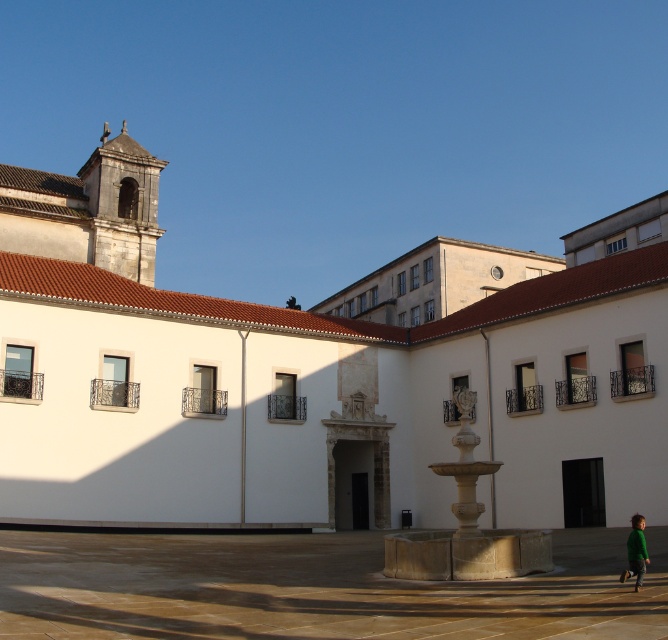
Question: Which is farther from the smooth stone fountain at center?

Choices:
 (A) white stone church at center
 (B) green matte shirt at lower right

Answer: (A)

Question: Which point is closer to the camera?

Choices:
 (A) smooth stone fountain at center
 (B) green matte shirt at lower right

Answer: (A)

Question: Is white stone church at center above smooth stone fountain at center?

Choices:
 (A) no
 (B) yes

Answer: (B)

Question: Can you confirm if white stone church at center is positioned above green matte shirt at lower right?

Choices:
 (A) yes
 (B) no

Answer: (A)

Question: Is smooth stone fountain at center positioned before green matte shirt at lower right?

Choices:
 (A) yes
 (B) no

Answer: (A)

Question: Estimate the real-world distances between objects in this image. Which object is closer to the green matte shirt at lower right?

Choices:
 (A) white stone church at center
 (B) smooth stone fountain at center

Answer: (B)